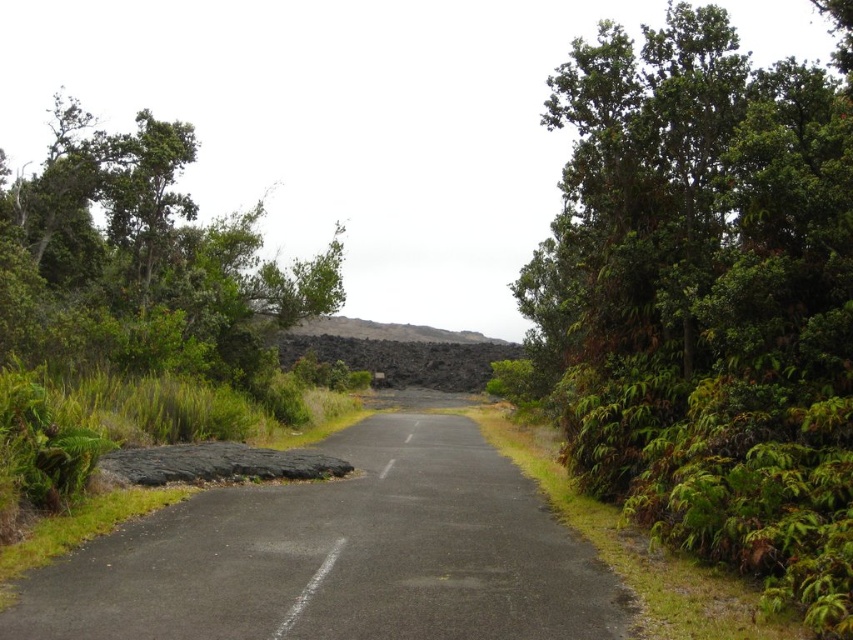
Question: Is green leafy tree at right smaller than green leafy tree at left?

Choices:
 (A) no
 (B) yes

Answer: (B)

Question: Which point appears closest to the camera in this image?

Choices:
 (A) (82, 344)
 (B) (747, 163)

Answer: (B)

Question: Is green leafy tree at right smaller than green leafy tree at left?

Choices:
 (A) yes
 (B) no

Answer: (A)

Question: Does green leafy tree at right lie in front of green leafy tree at left?

Choices:
 (A) no
 (B) yes

Answer: (B)